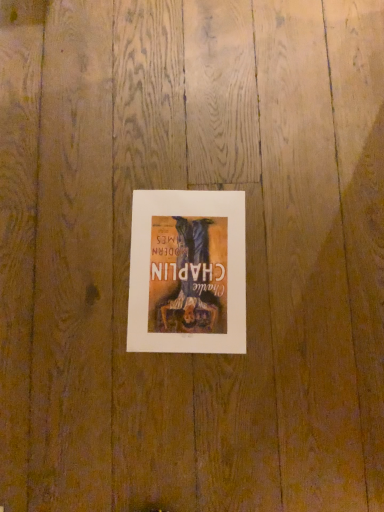
Where is `blank space situated above white paper at center (from a real-world perspective)`? The image size is (384, 512). blank space situated above white paper at center (from a real-world perspective) is located at coordinates (181, 260).